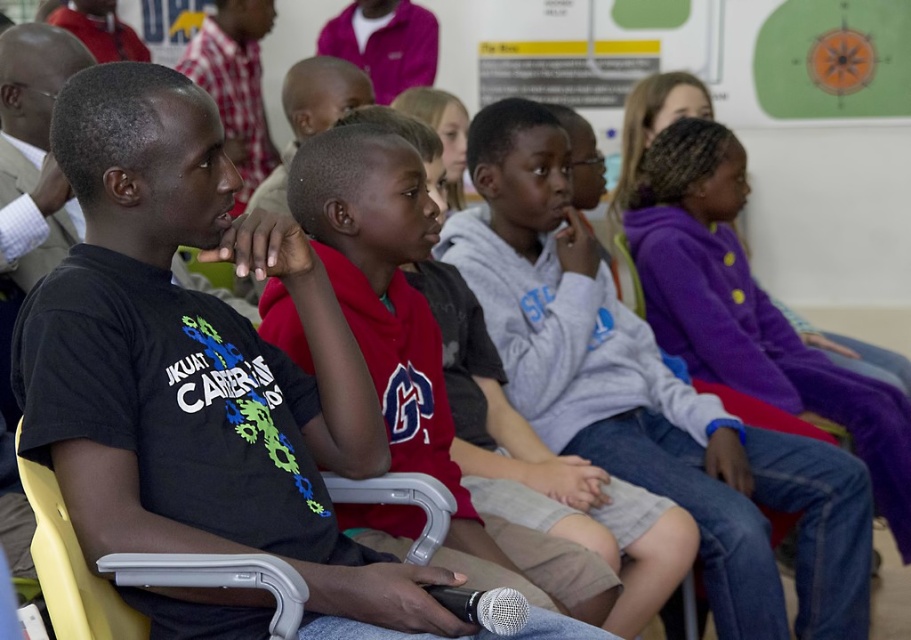
Question: From the image, what is the correct spatial relationship of purple fleece jacket at center in relation to silver metallic microphone at lower center?

Choices:
 (A) below
 (B) above

Answer: (B)

Question: Which point is farther to the camera?

Choices:
 (A) red matte shirt at center
 (B) silver metallic microphone at lower center
 (C) purple fleece jacket at center

Answer: (C)

Question: Is purple fleece jacket at center thinner than silver metallic microphone at lower center?

Choices:
 (A) yes
 (B) no

Answer: (B)

Question: Which point is farther to the camera?

Choices:
 (A) purple fleece jacket at center
 (B) silver metallic microphone at lower center

Answer: (A)

Question: Can you confirm if purple fleece jacket at center is bigger than silver metallic microphone at lower center?

Choices:
 (A) yes
 (B) no

Answer: (A)

Question: Which point is closer to the camera?

Choices:
 (A) red matte shirt at center
 (B) silver metallic microphone at lower center

Answer: (B)